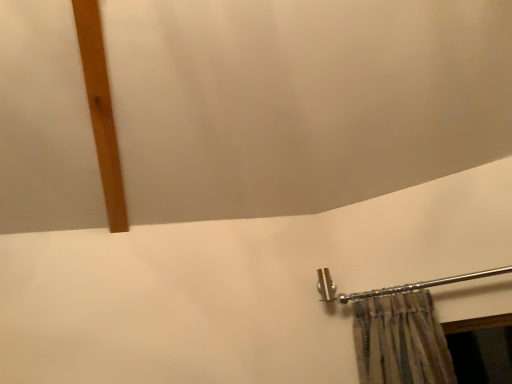
The image size is (512, 384). In order to click on polished metal towel bar at lower right in this screenshot , I will do `click(395, 286)`.

What do you see at coordinates (395, 286) in the screenshot? The height and width of the screenshot is (384, 512). I see `polished metal towel bar at lower right` at bounding box center [395, 286].

Identify the location of polished metal towel bar at lower right. This screenshot has width=512, height=384. (395, 286).